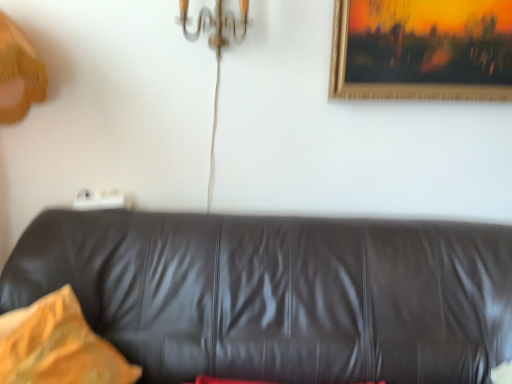
Question: Considering the relative sizes of yellow fabric pillow at left and black leather couch at center in the image provided, is yellow fabric pillow at left bigger than black leather couch at center?

Choices:
 (A) yes
 (B) no

Answer: (B)

Question: Is yellow fabric pillow at left oriented towards black leather couch at center?

Choices:
 (A) no
 (B) yes

Answer: (B)

Question: From a real-world perspective, does yellow fabric pillow at left stand above black leather couch at center?

Choices:
 (A) no
 (B) yes

Answer: (B)

Question: Considering the relative positions of yellow fabric pillow at left and black leather couch at center in the image provided, is yellow fabric pillow at left to the right of black leather couch at center from the viewer's perspective?

Choices:
 (A) yes
 (B) no

Answer: (B)

Question: Can you confirm if yellow fabric pillow at left is thinner than black leather couch at center?

Choices:
 (A) yes
 (B) no

Answer: (A)

Question: Looking at the image, does yellow fabric pillow at left seem bigger or smaller compared to gold-framed painting at upper right?

Choices:
 (A) small
 (B) big

Answer: (B)

Question: Does point (49, 349) appear closer or farther from the camera than point (397, 89)?

Choices:
 (A) farther
 (B) closer

Answer: (B)

Question: Is yellow fabric pillow at left taller or shorter than gold-framed painting at upper right?

Choices:
 (A) tall
 (B) short

Answer: (A)

Question: Choose the correct answer: Is yellow fabric pillow at left inside gold-framed painting at upper right or outside it?

Choices:
 (A) outside
 (B) inside

Answer: (A)

Question: Is yellow fabric pillow at left in front of or behind black leather couch at center in the image?

Choices:
 (A) behind
 (B) front

Answer: (A)

Question: Looking at their shapes, would you say yellow fabric pillow at left is wider or thinner than black leather couch at center?

Choices:
 (A) wide
 (B) thin

Answer: (B)

Question: Is yellow fabric pillow at left situated inside black leather couch at center or outside?

Choices:
 (A) inside
 (B) outside

Answer: (A)

Question: Is point (74, 359) closer or farther from the camera than point (104, 261)?

Choices:
 (A) closer
 (B) farther

Answer: (A)

Question: From a real-world perspective, is gold-framed painting at upper right above or below black leather couch at center?

Choices:
 (A) above
 (B) below

Answer: (A)

Question: Considering the positions of gold-framed painting at upper right and black leather couch at center in the image, is gold-framed painting at upper right taller or shorter than black leather couch at center?

Choices:
 (A) short
 (B) tall

Answer: (A)